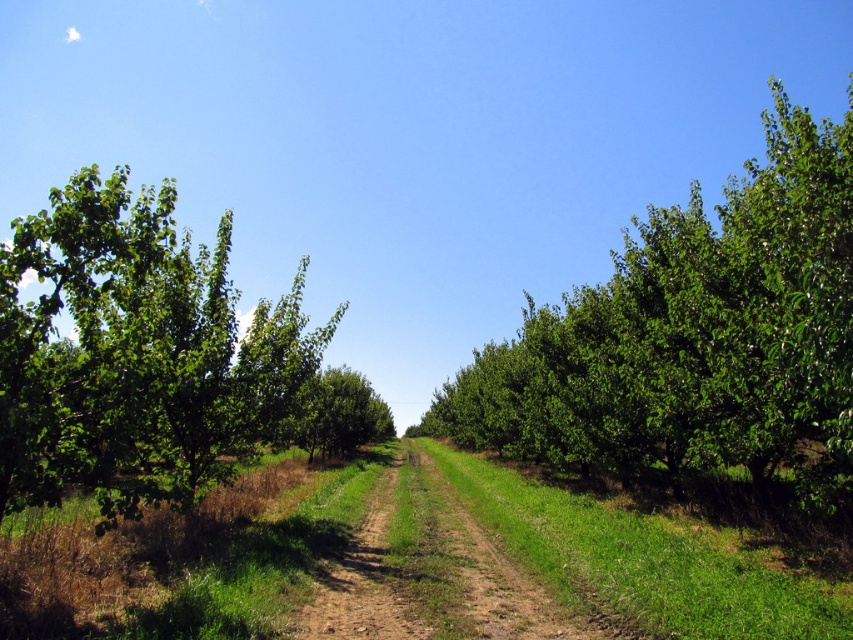
Can you confirm if green leafy tree at left is positioned to the right of brown dirt track at center?

Incorrect, green leafy tree at left is not on the right side of brown dirt track at center.

Which is behind, point (212, 388) or point (407, 582)?

Positioned behind is point (212, 388).

What do you see at coordinates (152, 358) in the screenshot? This screenshot has width=853, height=640. I see `green leafy tree at left` at bounding box center [152, 358].

The width and height of the screenshot is (853, 640). Identify the location of green leafy tree at left. (152, 358).

Is point (741, 262) positioned behind point (467, 563)?

No, it is not.

Which is behind, point (828, 353) or point (401, 532)?

Point (401, 532)

The image size is (853, 640). What are the coordinates of `green leafy tree at center` in the screenshot? It's located at pos(695,339).

Based on the photo, which is above, green leafy tree at center or green leafy tree at left?

Positioned higher is green leafy tree at center.

Who is lower down, green leafy tree at center or green leafy tree at left?

Positioned lower is green leafy tree at left.

You are a GUI agent. You are given a task and a screenshot of the screen. Output one action in this format:
    pyautogui.click(x=<x>, y=<y>)
    Task: Click on the green leafy tree at center
    This screenshot has width=853, height=640.
    Given the screenshot: What is the action you would take?
    pyautogui.click(x=695, y=339)